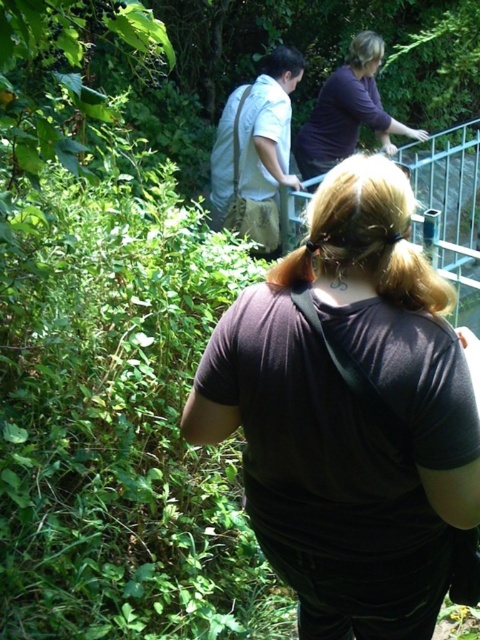
You are a hiker planning to take a photo of the dark brown fabric at center and dark purple shirt at upper center in the scene. If your camera has a maximum focus range of 10 feet, will you be able to capture both subjects clearly in one shot?

The dark brown fabric at center is 11.44 feet away from the dark purple shirt at upper center. Since the camera can only focus up to 10 feet, the distance between them exceeds the maximum focus range. Therefore, you cannot capture both subjects clearly in one shot.

Please look at the image. There is a point at coordinates (350,413). What object is located at that point?

The dark brown fabric at center is located at point (350,413).